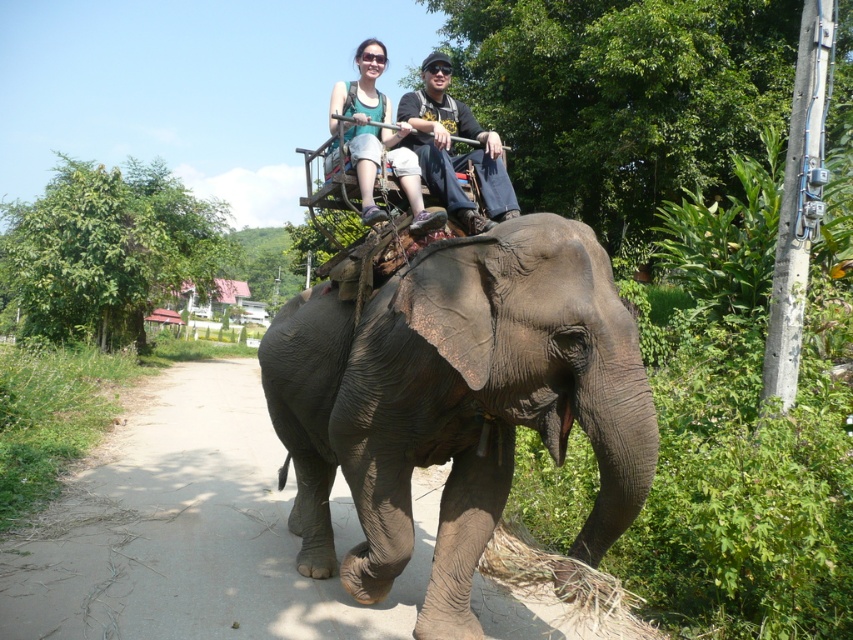
Based on the scene description, where is the gray textured elephant at center located in terms of its coordinates?

A: The gray textured elephant at center is located at coordinates point (457,403).

You are planning to take a photo of the elephant ride scene. The gray textured elephant at center and the matte black elephant at center are both in the frame. If you want to capture the entire width of both elephants in one shot, which elephant requires a wider angle to include its full body in the photo?

The gray textured elephant at center requires a wider angle to include its full body in the photo because its width surpasses that of the matte black elephant at center.

You are a tour guide leading a group through a jungle. You see two elephants, the gray textured elephant at center and the matte black elephant at center. Which one is closer to you?

The gray textured elephant at center is closer to you because it is positioned in front of the matte black elephant at center.